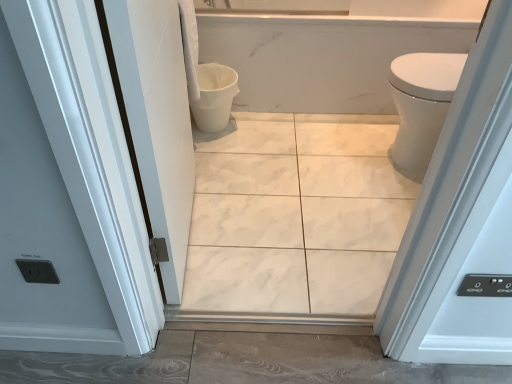
Question: Can you confirm if white glossy door at left is thinner than white marble tile at center?

Choices:
 (A) yes
 (B) no

Answer: (A)

Question: Is the position of white glossy door at left less distant than that of white marble tile at center?

Choices:
 (A) yes
 (B) no

Answer: (A)

Question: Does white glossy door at left have a greater width compared to white marble tile at center?

Choices:
 (A) no
 (B) yes

Answer: (A)

Question: Is white glossy door at left not within white marble tile at center?

Choices:
 (A) no
 (B) yes

Answer: (B)

Question: From a real-world perspective, is white glossy door at left physically below white marble tile at center?

Choices:
 (A) no
 (B) yes

Answer: (A)

Question: Looking at the image, does white glossy door at left seem bigger or smaller compared to white marble tile at center?

Choices:
 (A) small
 (B) big

Answer: (B)

Question: Is point click(x=147, y=14) closer or farther from the camera than point click(x=232, y=185)?

Choices:
 (A) closer
 (B) farther

Answer: (A)

Question: From a real-world perspective, is white glossy door at left physically located above or below white marble tile at center?

Choices:
 (A) below
 (B) above

Answer: (B)

Question: Is white glossy door at left inside or outside of white marble tile at center?

Choices:
 (A) outside
 (B) inside

Answer: (A)

Question: Is white glossy door at left inside or outside of white glossy bidet at right?

Choices:
 (A) outside
 (B) inside

Answer: (A)

Question: Relative to white glossy bidet at right, is white glossy door at left in front or behind?

Choices:
 (A) behind
 (B) front

Answer: (B)

Question: In terms of size, does white glossy door at left appear bigger or smaller than white glossy bidet at right?

Choices:
 (A) small
 (B) big

Answer: (B)

Question: From the image's perspective, is white glossy door at left above or below white glossy bidet at right?

Choices:
 (A) below
 (B) above

Answer: (A)

Question: In the image, is white marble tile at center positioned in front of or behind white glossy door at left?

Choices:
 (A) behind
 (B) front

Answer: (A)

Question: Considering the relative positions of white marble tile at center and white glossy door at left in the image provided, is white marble tile at center to the left or to the right of white glossy door at left?

Choices:
 (A) right
 (B) left

Answer: (A)